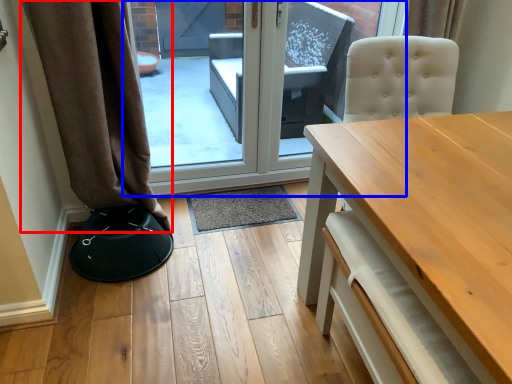
Question: Which object is further to the camera taking this photo, curtain (highlighted by a red box) or door (highlighted by a blue box)?

Choices:
 (A) curtain
 (B) door

Answer: (B)